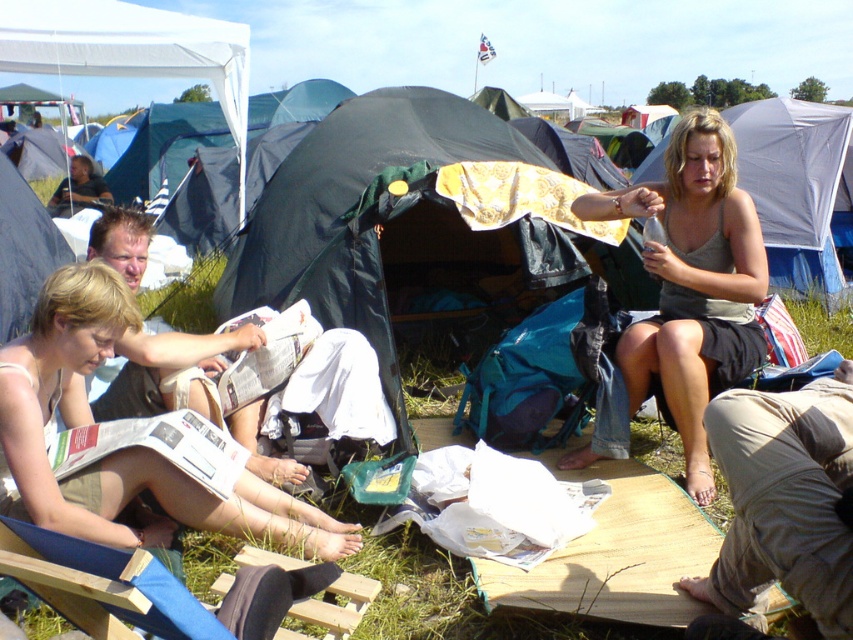
You are planning to set up a new tent in the camping area. You have a tent that is 1.2 meters wide. The black fabric tent at center is already occupying space. Can your new tent fit in the area next to the matte white newspaper at lower left without overlapping?

The black fabric tent at center is wider than the matte white newspaper at lower left. Since your new tent is 1.2 meters wide, you need to ensure there is enough space next to the matte white newspaper at lower left. However, the description only states the width comparison between the two objects, not the exact dimensions of the newspaper or the available space. Therefore, it is uncertain if the new tent will fit without overlapping.

You are a hiker who has just arrived at the campsite and need to set up your tent. You have a backpack that is 1.5 meters long. Can you safely place your backpack between the black fabric tent at center and the matte white newspaper at lower left without it overlapping either object?

The distance between the black fabric tent at center and the matte white newspaper at lower left is 1.53 meters. Since your backpack is 1.5 meters long, there is enough space to place it between them without overlapping either object.